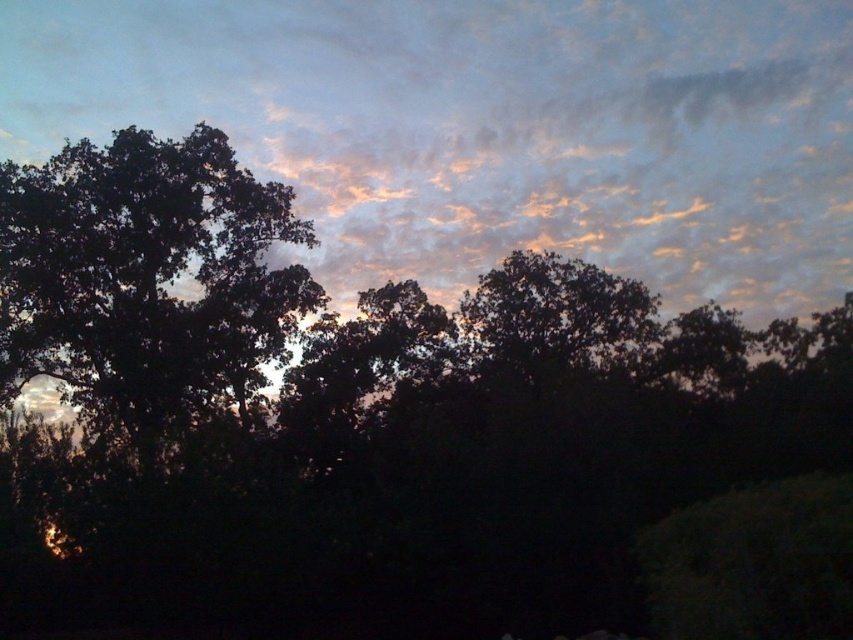
Is matte orange cloud at upper center taller than dark green leafy tree at left?

Correct, matte orange cloud at upper center is much taller as dark green leafy tree at left.

Between matte orange cloud at upper center and dark green leafy tree at left, which one appears on the left side from the viewer's perspective?

Positioned to the left is dark green leafy tree at left.

Identify the location of matte orange cloud at upper center. (486, 129).